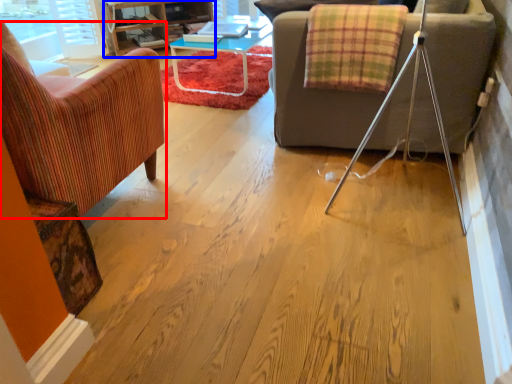
Question: Which object is further to the camera taking this photo, chair (highlighted by a red box) or entertainment center (highlighted by a blue box)?

Choices:
 (A) chair
 (B) entertainment center

Answer: (B)